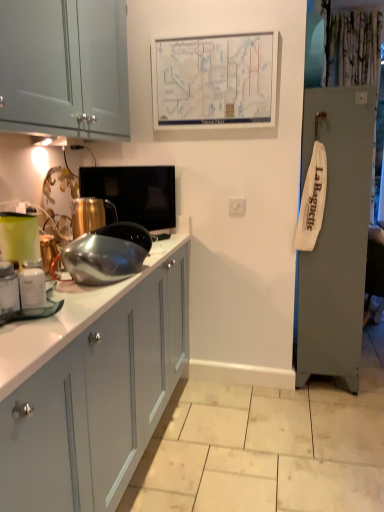
Find the location of `vacant area that is in front of white glossy jar at left, the fourth appliance from the back`. vacant area that is in front of white glossy jar at left, the fourth appliance from the back is located at coordinates (21, 330).